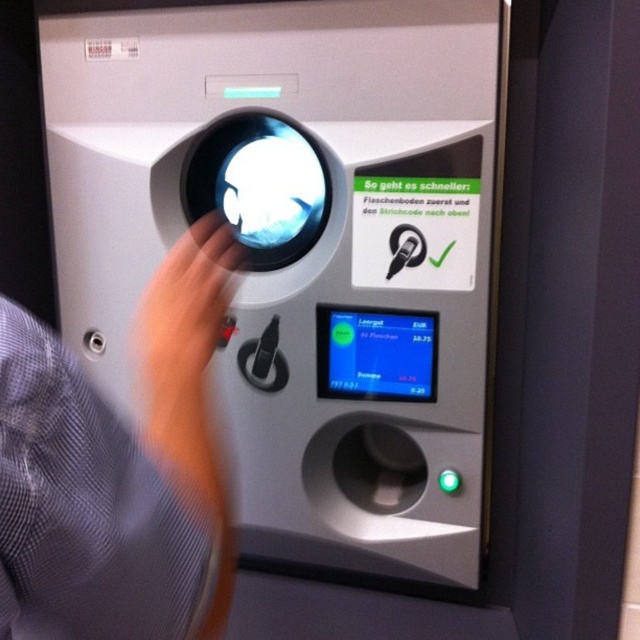
Can you confirm if metallic gray button at center is wider than matte black hand at upper center?

Correct, the width of metallic gray button at center exceeds that of matte black hand at upper center.

In the scene shown: Can you confirm if metallic gray button at center is positioned to the left of matte black hand at upper center?

No, metallic gray button at center is not to the left of matte black hand at upper center.

Which is in front, point (252, 538) or point (214, 340)?

Point (214, 340) is more forward.

Where is `metallic gray button at center`? The height and width of the screenshot is (640, 640). metallic gray button at center is located at coordinates (304, 252).

Which is behind, point (134, 566) or point (236, 262)?

The point (236, 262) is behind.

Does skinny fabric hand at center lie behind matte black hand at upper center?

No, it is not.

Find the location of a particular element. skinny fabric hand at center is located at coordinates (118, 470).

Where is `skinny fabric hand at center`? skinny fabric hand at center is located at coordinates (118, 470).

Can you confirm if metallic gray button at center is bigger than skinny fabric hand at center?

Correct, metallic gray button at center is larger in size than skinny fabric hand at center.

Is metallic gray button at center positioned behind skinny fabric hand at center?

That is True.

Is point (340, 106) positioned behind point (120, 538)?

That is True.

This screenshot has width=640, height=640. Find the location of `metallic gray button at center`. metallic gray button at center is located at coordinates (304, 252).